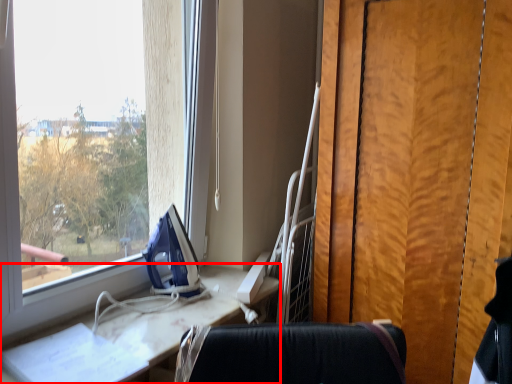
Question: From the image's perspective, where is furniture (annotated by the red box) located in relation to equipment in the image?

Choices:
 (A) above
 (B) below

Answer: (B)